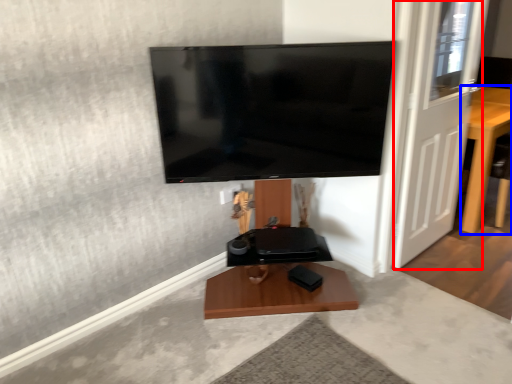
Question: Among these objects, which one is nearest to the camera, door (highlighted by a red box) or furniture (highlighted by a blue box)?

Choices:
 (A) door
 (B) furniture

Answer: (A)